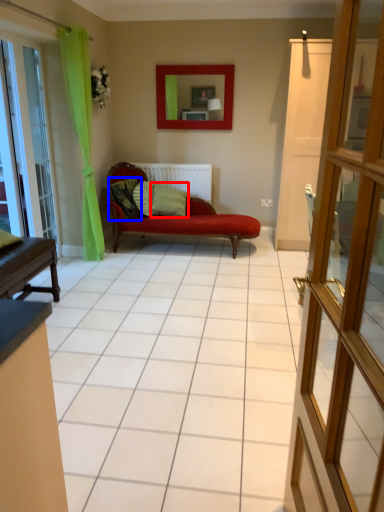
Question: Among these objects, which one is farthest to the camera, pillow (highlighted by a red box) or pillow (highlighted by a blue box)?

Choices:
 (A) pillow
 (B) pillow

Answer: (A)